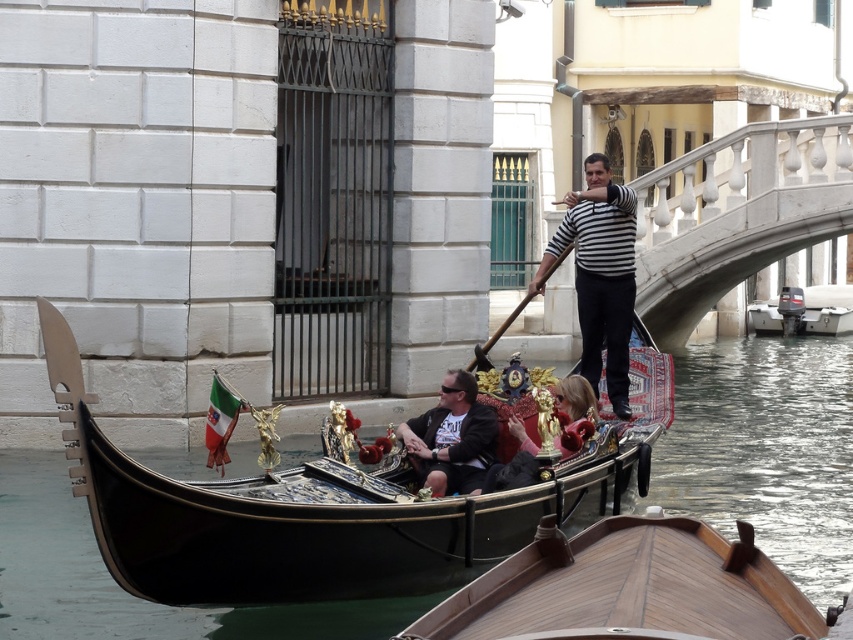
You are standing on the bridge overlooking the canal. You notice a gondola with passengers and a gondolier. There is a point marked at coordinates (x=599, y=275). What object is located at that point?

The object at point (x=599, y=275) is the striped fabric man at center.